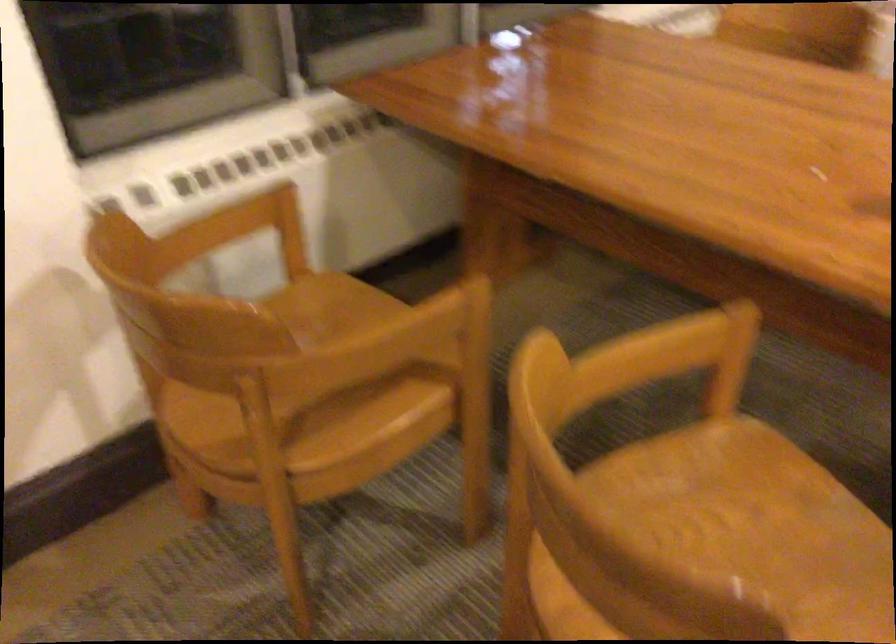
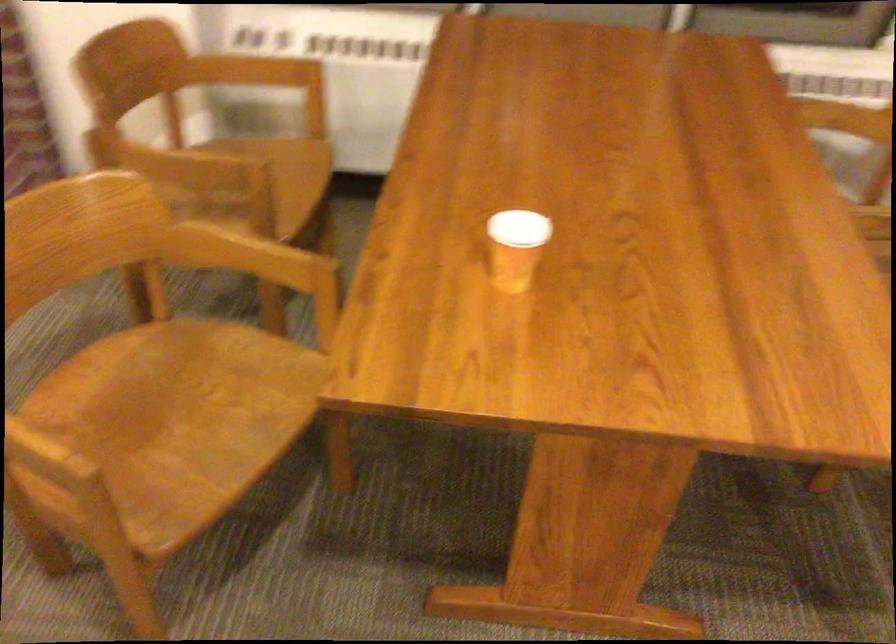
The point at (793, 569) is marked in the first image. Where is the corresponding point in the second image?

(170, 424)